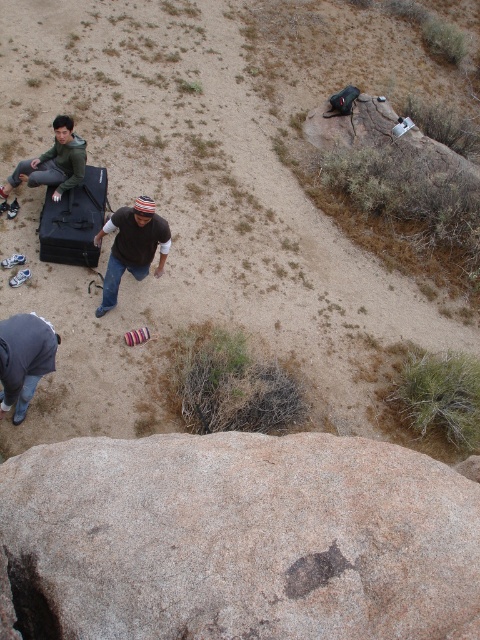
You are planning to set up a campsite in this desert area. You have a gray fabric squat at lower left and a brown rock at center. Which object should you avoid placing your tent near to prevent it from being in a low area prone to water accumulation?

The gray fabric squat at lower left is located at the lower left position, which is likely a lower area. You should avoid placing your tent near the gray fabric squat at lower left to prevent water accumulation.

You are planning to place a small tent between the brown rock at center and the brown cotton shirt at center. Considering their sizes, which object will require more space horizontally?

The brown rock at center requires more horizontal space because its width is larger than that of the brown cotton shirt at center.